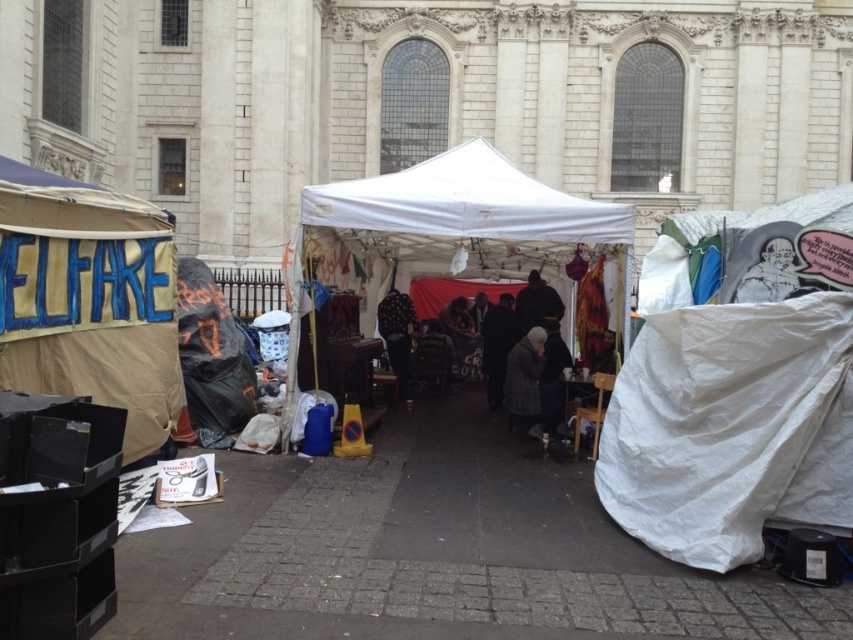
Question: Which object is closer to the camera taking this photo?

Choices:
 (A) white fabric tent at center
 (B) white tarp at right

Answer: (B)

Question: Can you confirm if white fabric canopy at center is smaller than polka dot fabric at center?

Choices:
 (A) no
 (B) yes

Answer: (A)

Question: Which of the following is the closest to the observer?

Choices:
 (A) polka dot fabric at center
 (B) white fabric canopy at center

Answer: (B)

Question: Among these points, which one is nearest to the camera?

Choices:
 (A) pyautogui.click(x=686, y=483)
 (B) pyautogui.click(x=393, y=323)

Answer: (A)

Question: Does white tarp at right have a smaller size compared to polka dot fabric at center?

Choices:
 (A) yes
 (B) no

Answer: (B)

Question: Is white tarp at right smaller than beige canvas tent at left?

Choices:
 (A) no
 (B) yes

Answer: (B)